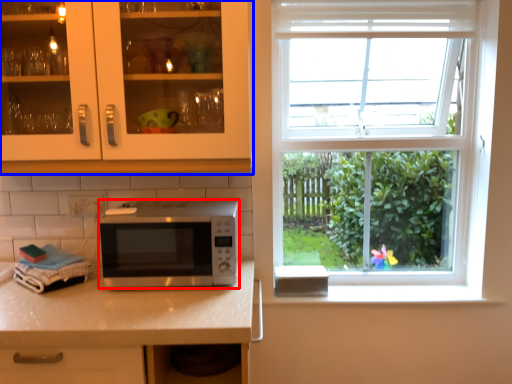
Question: Which object appears closest to the camera in this image, microwave oven (highlighted by a red box) or cabinetry (highlighted by a blue box)?

Choices:
 (A) microwave oven
 (B) cabinetry

Answer: (B)